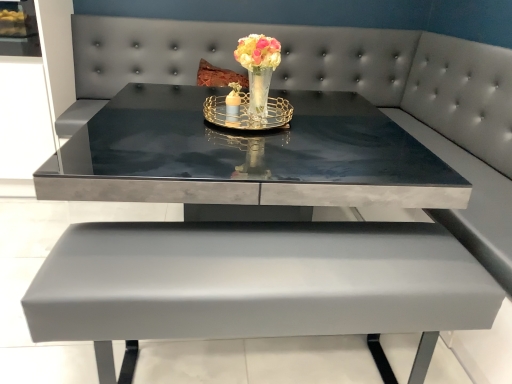
Locate an element on the screen. Image resolution: width=512 pixels, height=384 pixels. vacant space to the right of gold metallic tray at center is located at coordinates (337, 129).